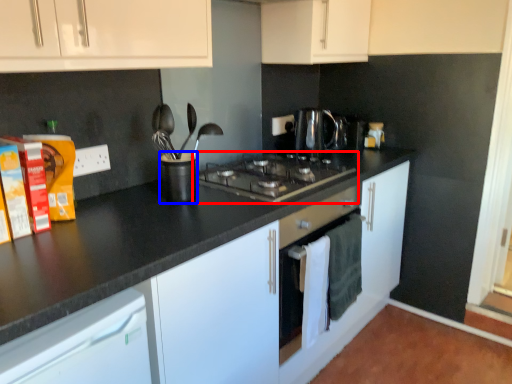
Question: Which point is closer to the camera, gas stove (highlighted by a red box) or appliance (highlighted by a blue box)?

Choices:
 (A) gas stove
 (B) appliance

Answer: (B)